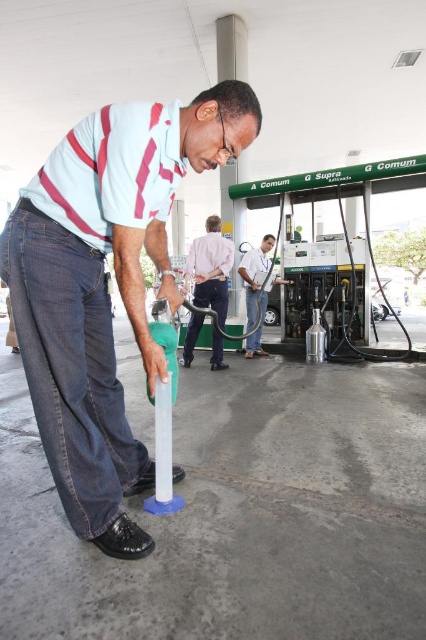
Who is higher up, matte plastic pump handle at center or white glossy fuel nozzle at center?

Positioned higher is white glossy fuel nozzle at center.

Who is more forward, (89, 204) or (259, 260)?

Point (89, 204) is more forward.

The height and width of the screenshot is (640, 426). Identify the location of matte plastic pump handle at center. (103, 285).

Is matte plastic pump handle at center closer to the viewer compared to pink cotton shirt at center?

Yes, matte plastic pump handle at center is closer to the viewer.

Locate an element on the screen. This screenshot has width=426, height=640. matte plastic pump handle at center is located at coordinates (103, 285).

From the picture: Which is more to the right, pink cotton shirt at center or white glossy fuel nozzle at center?

From the viewer's perspective, white glossy fuel nozzle at center appears more on the right side.

Is pink cotton shirt at center positioned in front of white glossy fuel nozzle at center?

That is True.

This screenshot has height=640, width=426. Find the location of `pink cotton shirt at center`. pink cotton shirt at center is located at coordinates (210, 268).

You are a GUI agent. You are given a task and a screenshot of the screen. Output one action in this format:
    pyautogui.click(x=<x>, y=<y>)
    Task: Click on the pink cotton shirt at center
    This screenshot has width=426, height=640.
    Given the screenshot: What is the action you would take?
    pyautogui.click(x=210, y=268)